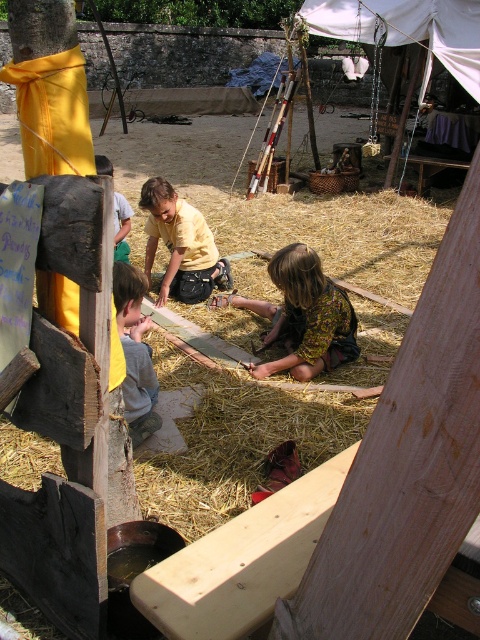
Measure the distance between white fabric canopy at upper center and light blue t-shirt at lower left.

4.59 meters

Does white fabric canopy at upper center come in front of light blue t-shirt at lower left?

No, it is not.

What do you see at coordinates (408, 29) in the screenshot? The width and height of the screenshot is (480, 640). I see `white fabric canopy at upper center` at bounding box center [408, 29].

The width and height of the screenshot is (480, 640). In order to click on white fabric canopy at upper center in this screenshot , I will do (408, 29).

Is printed fabric dress at center taller than light blue t-shirt at lower left?

Indeed, printed fabric dress at center has a greater height compared to light blue t-shirt at lower left.

Is printed fabric dress at center in front of light blue t-shirt at lower left?

Yes, printed fabric dress at center is in front of light blue t-shirt at lower left.

Is point (262, 346) positioned after point (106, 157)?

No, it is not.

This screenshot has height=640, width=480. Identify the location of printed fabric dress at center. (302, 316).

Is white fabric canopy at upper center thinner than gray fabric shirt at lower left?

In fact, white fabric canopy at upper center might be wider than gray fabric shirt at lower left.

Is white fabric canopy at upper center behind gray fabric shirt at lower left?

Yes, it is.

Who is more distant from viewer, (456, 67) or (121, 294)?

Positioned behind is point (456, 67).

What are the coordinates of `white fabric canopy at upper center` in the screenshot? It's located at [x=408, y=29].